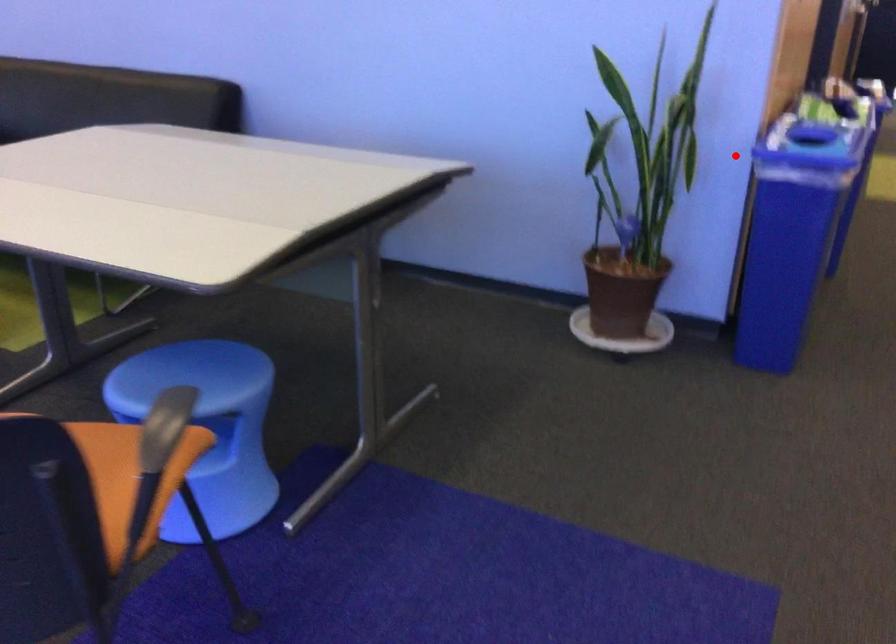
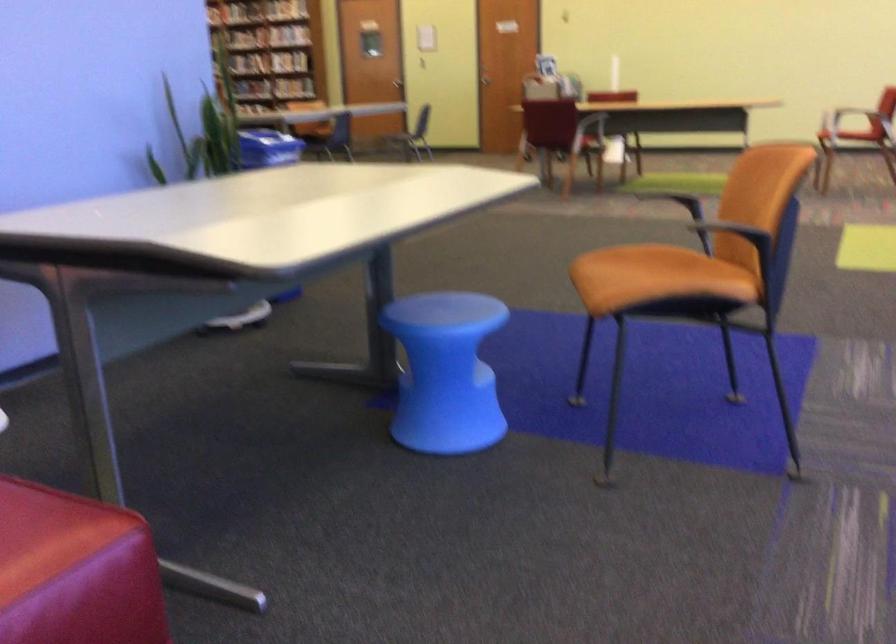
Question: I am providing you with two images of the same scene from different viewpoints. Given a red point in image1, look at the same physical point in image2. Is it:

Choices:
 (A) Closer to the viewpoint
 (B) Farther from the viewpoint

Answer: (B)